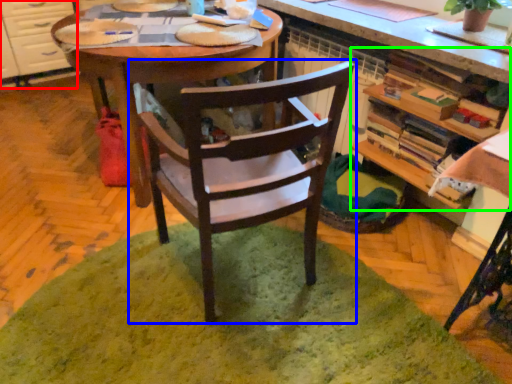
Question: Which is farther away from cabinetry (highlighted by a red box)? chair (highlighted by a blue box) or shelf (highlighted by a green box)?

Choices:
 (A) chair
 (B) shelf

Answer: (B)